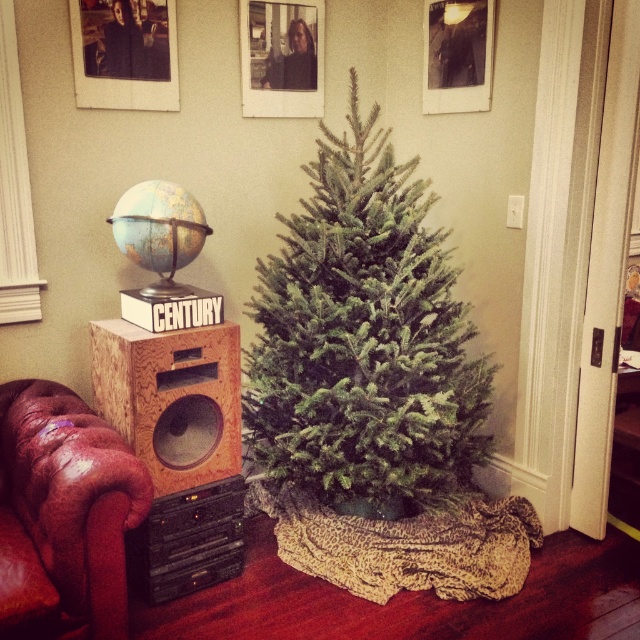
Does green natural fir tree at center have a greater height compared to leather at left?

Yes.

What do you see at coordinates (364, 340) in the screenshot? The image size is (640, 640). I see `green natural fir tree at center` at bounding box center [364, 340].

You are a GUI agent. You are given a task and a screenshot of the screen. Output one action in this format:
    pyautogui.click(x=<x>, y=<y>)
    Task: Click on the green natural fir tree at center
    The height and width of the screenshot is (640, 640).
    Given the screenshot: What is the action you would take?
    pyautogui.click(x=364, y=340)

Can you confirm if leather at left is wider than wooden speaker at left?

Yes, leather at left is wider than wooden speaker at left.

Between point (13, 534) and point (125, 429), which one is positioned behind?

The point (125, 429) is more distant.

Does point (42, 381) come farther from viewer compared to point (164, 474)?

Yes, it is.

The width and height of the screenshot is (640, 640). In order to click on leather at left in this screenshot , I will do `click(64, 515)`.

Which is in front, point (371, 148) or point (225, 467)?

Point (225, 467)

Does green natural fir tree at center have a smaller size compared to wooden speaker at left?

Actually, green natural fir tree at center might be larger than wooden speaker at left.

Is point (381, 173) closer to camera compared to point (122, 326)?

No, (381, 173) is further to viewer.

At what (x,y) coordinates should I click in order to perform the action: click on green natural fir tree at center. Please return your answer as a coordinate pair (x, y). Looking at the image, I should click on (364, 340).